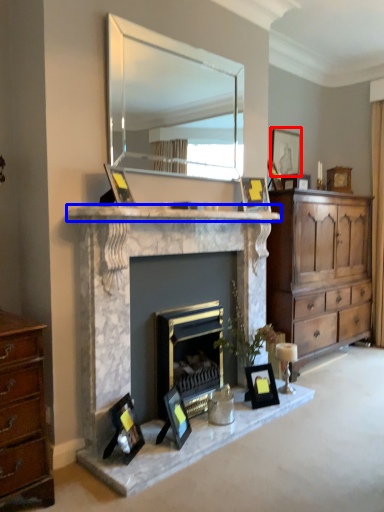
Question: Which point is further to the camera, picture frame (highlighted by a red box) or mantle (highlighted by a blue box)?

Choices:
 (A) picture frame
 (B) mantle

Answer: (A)